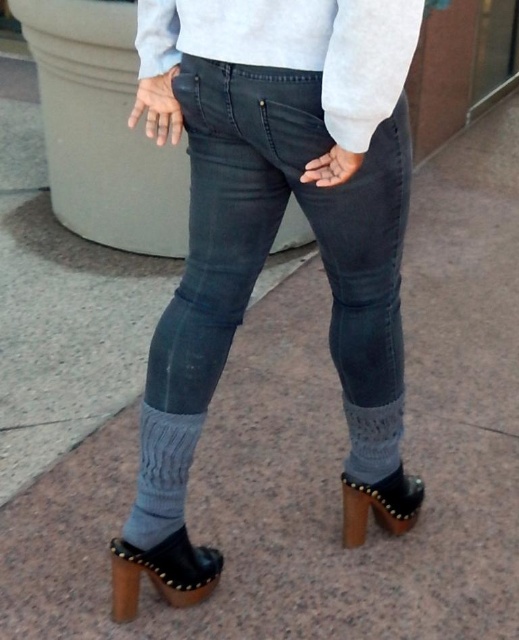
Question: Which point is closer to the camera taking this photo?

Choices:
 (A) (348, 129)
 (B) (362, 317)

Answer: (A)

Question: Which is nearer to the black leather sandal at lower right?

Choices:
 (A) dark denim jeans at center
 (B) matte black clog at lower right
 (C) light gray sweater at center

Answer: (B)

Question: Is light gray sweater at center to the right of matte black clog at lower right from the viewer's perspective?

Choices:
 (A) yes
 (B) no

Answer: (B)

Question: From the image, what is the correct spatial relationship of dark denim jeans at center in relation to light gray sweater at center?

Choices:
 (A) below
 (B) above

Answer: (A)

Question: Can you confirm if light gray sweater at center is thinner than matte black clog at lower right?

Choices:
 (A) yes
 (B) no

Answer: (B)

Question: Which point is farther to the camera?

Choices:
 (A) (224, 29)
 (B) (381, 484)
 (C) (386, 417)

Answer: (B)